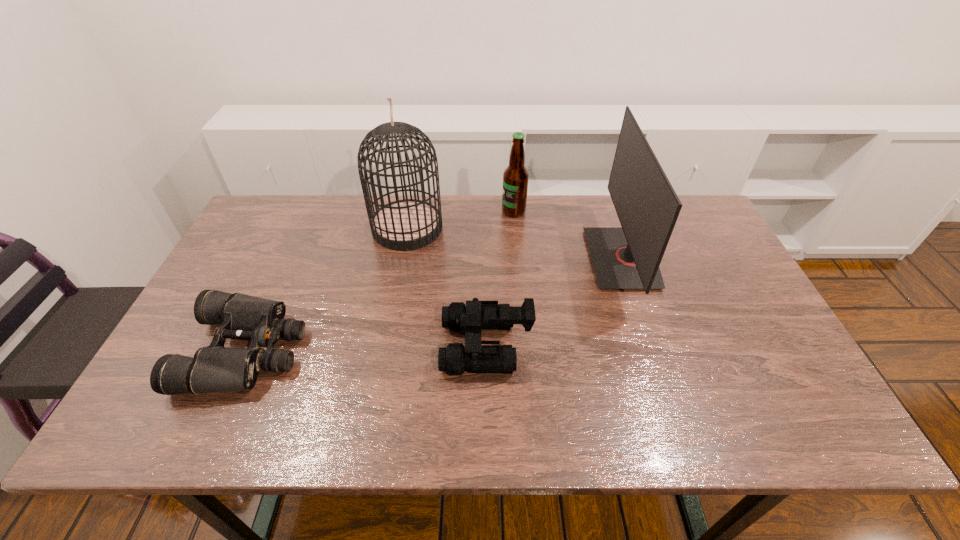
Locate an element on the screen. Image resolution: width=960 pixels, height=540 pixels. vacant space that's between the taller binoculars and the beer bottle is located at coordinates (500, 278).

Locate an element on the screen. vacant space in between the fourth object from right to left and the third shortest object is located at coordinates (461, 220).

Locate an element on the screen. This screenshot has height=540, width=960. vacant area between the second object from left to right and the rightmost object is located at coordinates (515, 243).

The height and width of the screenshot is (540, 960). I want to click on vacant area between the birdcage and the left binoculars, so click(x=327, y=289).

At what (x,y) coordinates should I click in order to perform the action: click on free point between the beer bottle and the leftmost object. Please return your answer as a coordinate pair (x, y). This screenshot has width=960, height=540. Looking at the image, I should click on (380, 281).

Where is `free space between the shortest object and the birdcage`? The image size is (960, 540). free space between the shortest object and the birdcage is located at coordinates (327, 289).

The height and width of the screenshot is (540, 960). What are the coordinates of `empty space that is in between the left binoculars and the monitor` in the screenshot? It's located at pyautogui.click(x=435, y=305).

This screenshot has width=960, height=540. Find the location of `unoccupied area between the second tallest object and the leftmost object`. unoccupied area between the second tallest object and the leftmost object is located at coordinates (435, 305).

What are the coordinates of `object that can be found as the fourth closest to the birdcage` in the screenshot? It's located at (628, 257).

This screenshot has height=540, width=960. Find the location of `object that stands as the second closest to the rightmost object`. object that stands as the second closest to the rightmost object is located at coordinates (470, 319).